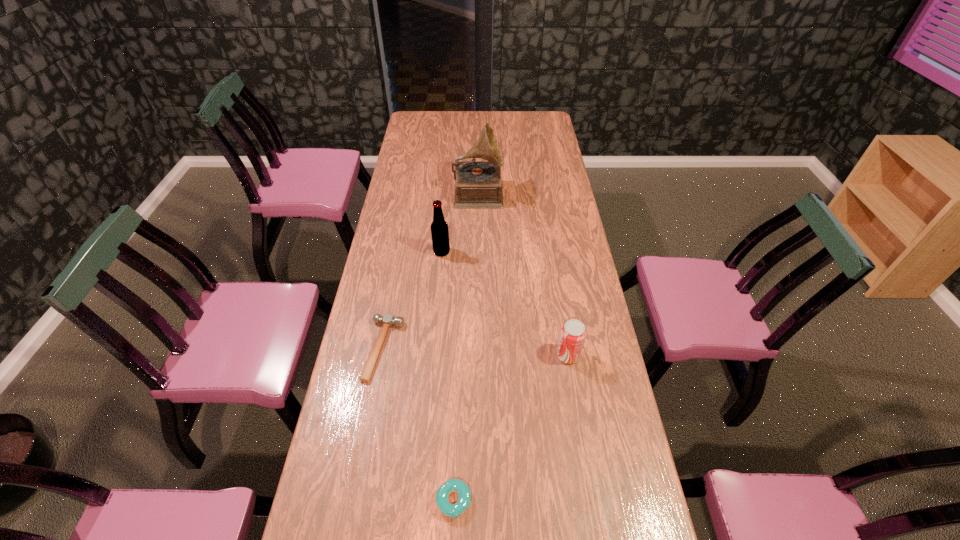
Find the location of a particular element. Image resolution: width=960 pixels, height=540 pixels. empty location between the soda can and the leftmost object is located at coordinates (476, 352).

Select which object is the third closest to the nearest object. Please provide its 2D coordinates. Your answer should be formatted as a tuple, i.e. [(x, y)], where the tuple contains the x and y coordinates of a point satisfying the conditions above.

[(439, 228)]

Find the location of a particular element. The image size is (960, 540). object that is the second closest to the second farthest object is located at coordinates (388, 320).

This screenshot has width=960, height=540. I want to click on vacant area in the image that satisfies the following two spatial constraints: 1. on the logo side of the third shortest object; 2. on the front side of the nearest object, so click(x=592, y=501).

Where is `free location that satisfies the following two spatial constraints: 1. from the horn of the tallest object; 2. on the front side of the leftmost object`? The height and width of the screenshot is (540, 960). free location that satisfies the following two spatial constraints: 1. from the horn of the tallest object; 2. on the front side of the leftmost object is located at coordinates (477, 349).

Locate an element on the screen. This screenshot has width=960, height=540. vacant area that satisfies the following two spatial constraints: 1. on the back side of the beer bottle; 2. on the left side of the leftmost object is located at coordinates click(x=401, y=252).

This screenshot has height=540, width=960. What are the coordinates of `free space that satisfies the following two spatial constraints: 1. on the logo side of the third shortest object; 2. on the front side of the nearest object` in the screenshot? It's located at (592, 501).

Where is `free point that satisfies the following two spatial constraints: 1. on the back side of the hammer; 2. on the right side of the beer bottle`? free point that satisfies the following two spatial constraints: 1. on the back side of the hammer; 2. on the right side of the beer bottle is located at coordinates (401, 252).

Identify the location of vacant space that satisfies the following two spatial constraints: 1. on the front side of the fourth nearest object; 2. on the left side of the doughnut. (420, 501).